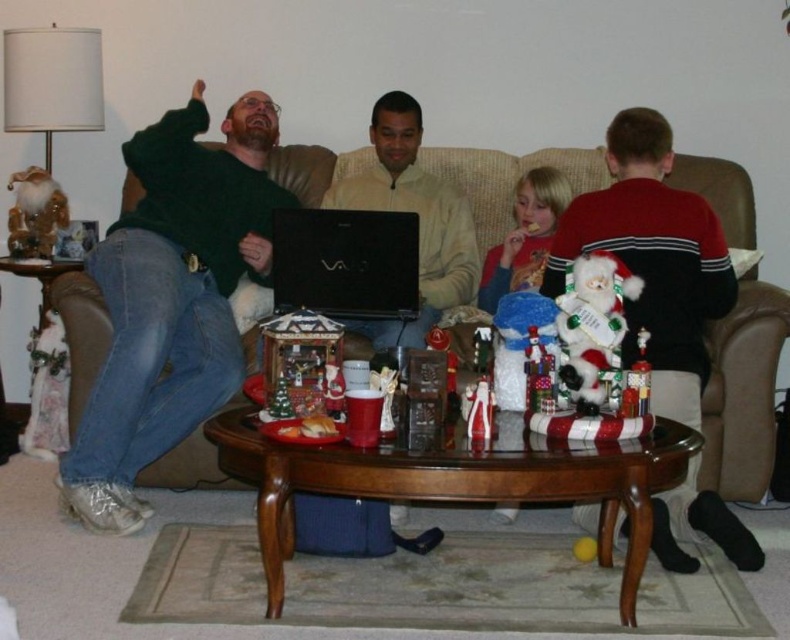
Describe the element at coordinates (171, 300) in the screenshot. I see `white plush santa at left` at that location.

Can you confirm if white plush santa at left is thinner than black matte laptop at center?

No, white plush santa at left is not thinner than black matte laptop at center.

Is point (106, 474) farther from viewer compared to point (307, 307)?

That is False.

Where is `white plush santa at left`? Image resolution: width=790 pixels, height=640 pixels. white plush santa at left is located at coordinates (171, 300).

Does black matte laptop at center have a greater height compared to blonde hair at center?

No.

From the picture: Can you confirm if black matte laptop at center is shorter than blonde hair at center?

Correct, black matte laptop at center is not as tall as blonde hair at center.

What do you see at coordinates (345, 262) in the screenshot? Image resolution: width=790 pixels, height=640 pixels. I see `black matte laptop at center` at bounding box center [345, 262].

This screenshot has width=790, height=640. What are the coordinates of `black matte laptop at center` in the screenshot? It's located at (345, 262).

Can you confirm if brown leather couch at center is thinner than black matte laptop at center?

Yes, brown leather couch at center is thinner than black matte laptop at center.

Does brown leather couch at center come in front of black matte laptop at center?

Yes, it is in front of black matte laptop at center.

The width and height of the screenshot is (790, 640). Describe the element at coordinates (743, 392) in the screenshot. I see `brown leather couch at center` at that location.

Locate an element on the screen. brown leather couch at center is located at coordinates (743, 392).